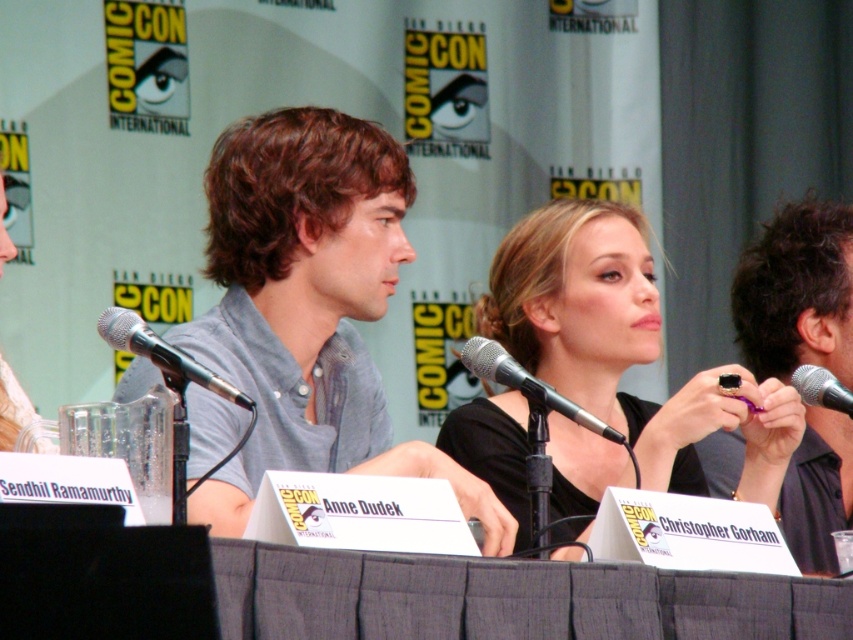
Question: Is black plastic ring at right thinner than silver metallic microphone at left?

Choices:
 (A) yes
 (B) no

Answer: (B)

Question: Which point appears closest to the camera in this image?

Choices:
 (A) (828, 392)
 (B) (170, 381)
 (C) (268, 282)

Answer: (B)

Question: Which point is closer to the camera taking this photo?

Choices:
 (A) (814, 518)
 (B) (798, 372)
 (C) (115, 326)
 (D) (552, 408)

Answer: (C)

Question: Does black plastic ring at right lie behind black metallic microphone at right?

Choices:
 (A) no
 (B) yes

Answer: (B)

Question: Which point is closer to the camera?

Choices:
 (A) (238, 392)
 (B) (618, 442)
 (C) (839, 403)

Answer: (A)

Question: Where is black plastic ring at right located in relation to black metallic microphone at right in the image?

Choices:
 (A) above
 (B) below

Answer: (A)